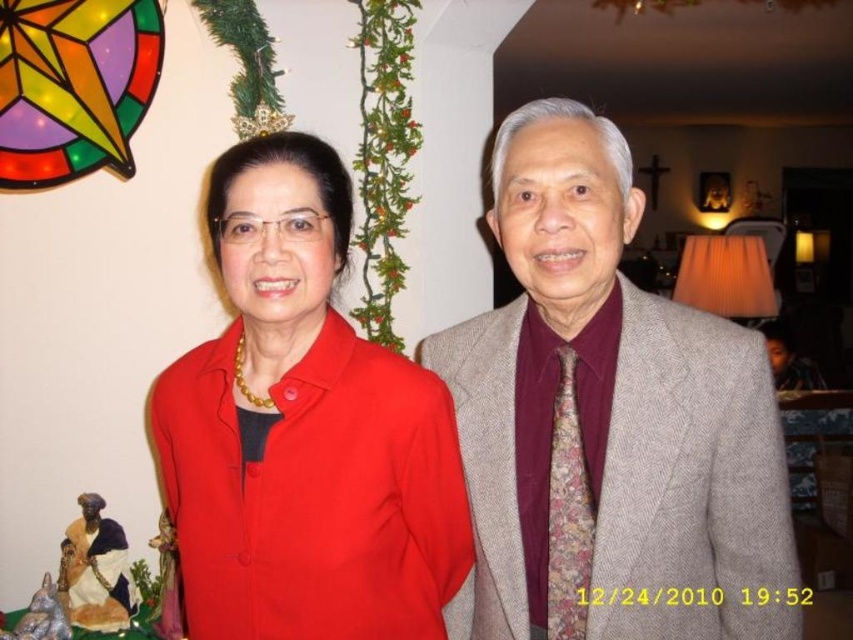
Question: Does gray textured suit at center appear on the right side of matte red shirt at center?

Choices:
 (A) yes
 (B) no

Answer: (A)

Question: Is gray textured suit at center closer to camera compared to matte red shirt at center?

Choices:
 (A) no
 (B) yes

Answer: (A)

Question: Which point is farther from the camera taking this photo?

Choices:
 (A) (312, 611)
 (B) (469, 435)

Answer: (B)

Question: Is gray textured suit at center bigger than matte red shirt at center?

Choices:
 (A) no
 (B) yes

Answer: (B)